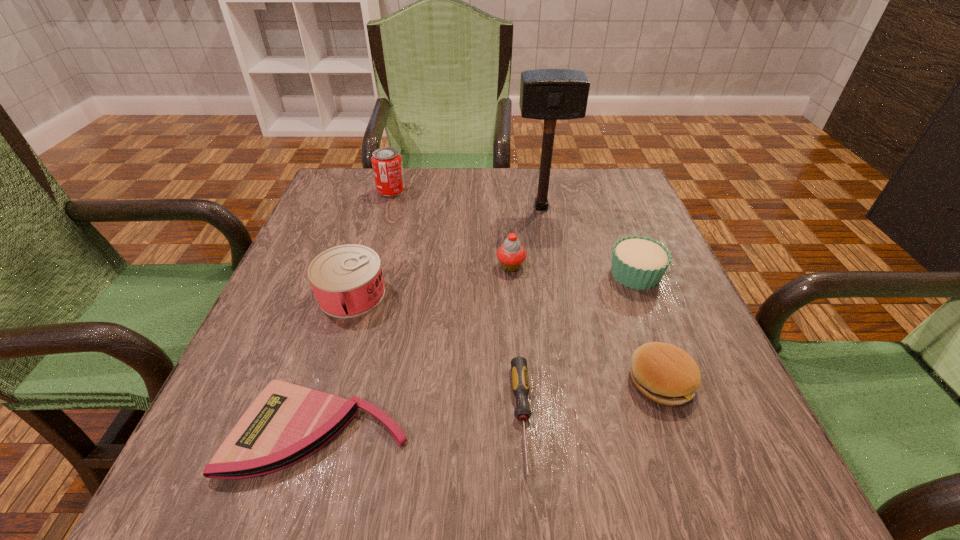
The height and width of the screenshot is (540, 960). Find the location of `screwdriver at the near edge`. screwdriver at the near edge is located at coordinates (520, 383).

This screenshot has height=540, width=960. I want to click on wristlet located at the left edge, so click(x=286, y=423).

I want to click on cupcake that is at the right edge, so click(638, 262).

This screenshot has width=960, height=540. I want to click on patty present at the right edge, so click(x=663, y=373).

The width and height of the screenshot is (960, 540). Identify the location of object that is at the far left corner. (387, 165).

This screenshot has height=540, width=960. Find the location of `object present at the near left corner`. object present at the near left corner is located at coordinates (286, 423).

In the image, there is a desktop. Identify the location of vacant space at the far edge. The width and height of the screenshot is (960, 540). (509, 181).

In the image, there is a desktop. At what (x,y) coordinates should I click in order to perform the action: click on blank space at the near edge. Please return your answer as a coordinate pair (x, y). The image size is (960, 540). Looking at the image, I should click on (499, 483).

The image size is (960, 540). I want to click on vacant space at the left edge of the desktop, so click(333, 228).

This screenshot has height=540, width=960. What are the coordinates of `vacant area at the right edge` in the screenshot? It's located at (616, 288).